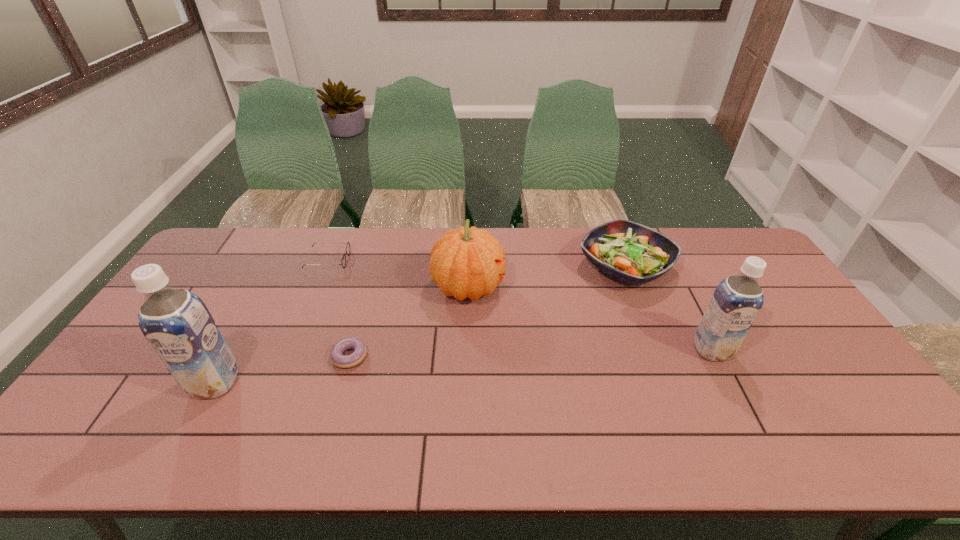
The height and width of the screenshot is (540, 960). I want to click on empty location between the third tallest object and the left soya milk, so click(x=342, y=335).

The width and height of the screenshot is (960, 540). In order to click on free spot between the second object from left to right and the right soya milk in this screenshot , I will do `click(519, 305)`.

Identify the location of free space between the fifth object from right to left and the right soya milk. Image resolution: width=960 pixels, height=540 pixels. (519, 305).

You are a GUI agent. You are given a task and a screenshot of the screen. Output one action in this format:
    pyautogui.click(x=<x>, y=<y>)
    Task: Click on the free space between the fourth object from right to left and the tallest object
    
    Given the screenshot: What is the action you would take?
    pyautogui.click(x=282, y=369)

This screenshot has height=540, width=960. I want to click on free spot between the salad plate and the pumpkin, so click(x=547, y=277).

At what (x,y) coordinates should I click in order to perform the action: click on object that stands as the fifth closest to the shortest object. Please return your answer as a coordinate pair (x, y). This screenshot has width=960, height=540. Looking at the image, I should click on (737, 300).

Locate which object is the fifth closest to the nearer soya milk. Please provide its 2D coordinates. Your answer should be formatted as a tuple, i.e. [(x, y)], where the tuple contains the x and y coordinates of a point satisfying the conditions above.

[(737, 300)]

Find the location of a particular element. free region that satisfies the following two spatial constraints: 1. on the front-facing side of the third object from left to right; 2. on the right side of the sunglasses is located at coordinates (288, 356).

In order to click on vacant space that satisfies the following two spatial constraints: 1. on the front side of the salad plate; 2. on the carved face of the fourth object from left to right in this screenshot , I will do `click(633, 287)`.

This screenshot has height=540, width=960. I want to click on vacant space that satisfies the following two spatial constraints: 1. on the carved face of the fourth object from left to right; 2. on the label of the tallest object, so click(x=466, y=382).